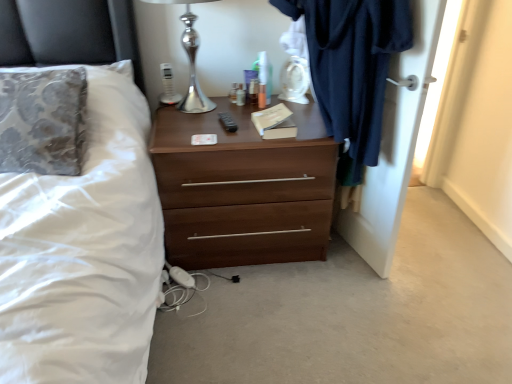
Where is `free space on the front side of silver metallic table lamp at upper center`? Image resolution: width=512 pixels, height=384 pixels. free space on the front side of silver metallic table lamp at upper center is located at coordinates (196, 134).